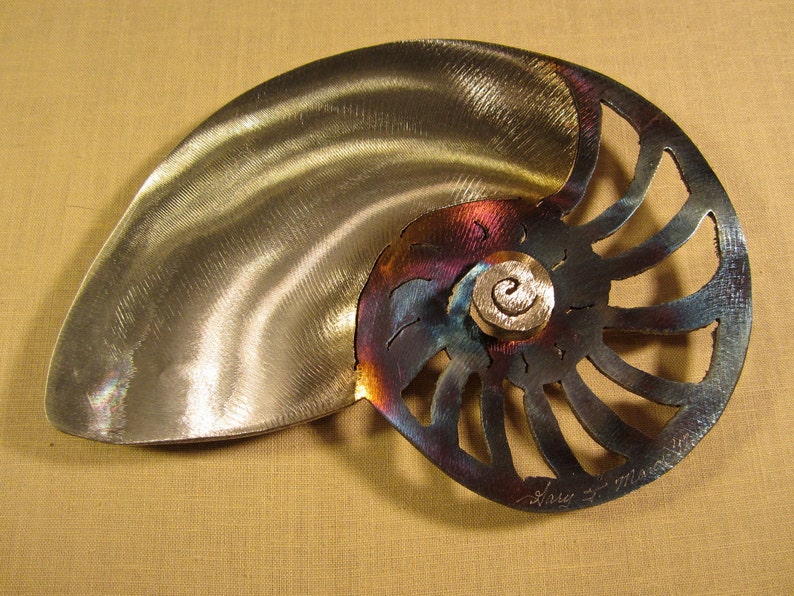
I want to click on frame, so click(x=576, y=164), click(x=631, y=184), click(x=672, y=234), click(x=700, y=313), click(x=646, y=381), click(x=595, y=415), click(x=536, y=415), click(x=487, y=424), click(x=441, y=403), click(x=405, y=347).